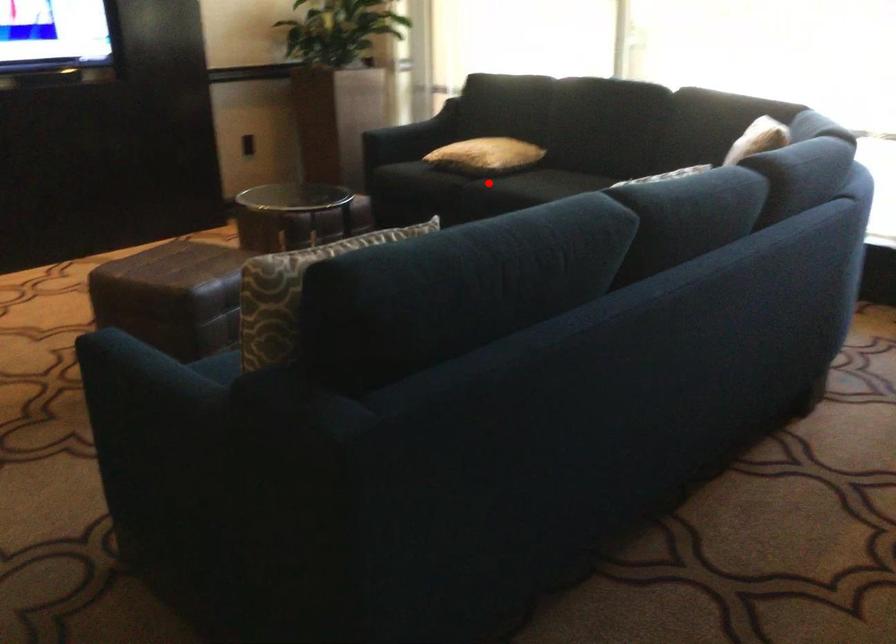
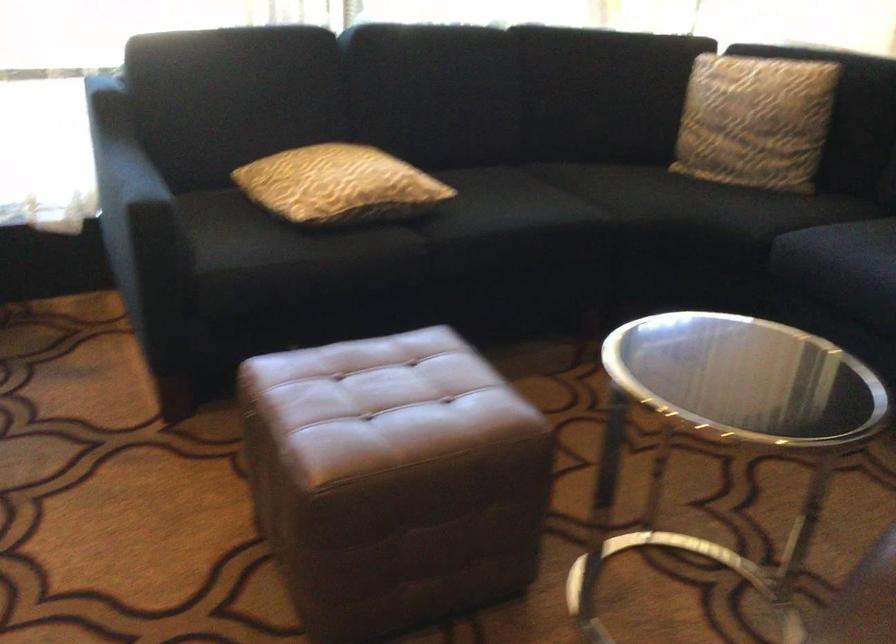
Question: I am providing you with two images of the same scene from different viewpoints. A red point is shown in image1. For the corresponding object point in image2, is it positioned nearer or farther from the camera?

Choices:
 (A) Nearer
 (B) Farther

Answer: (A)